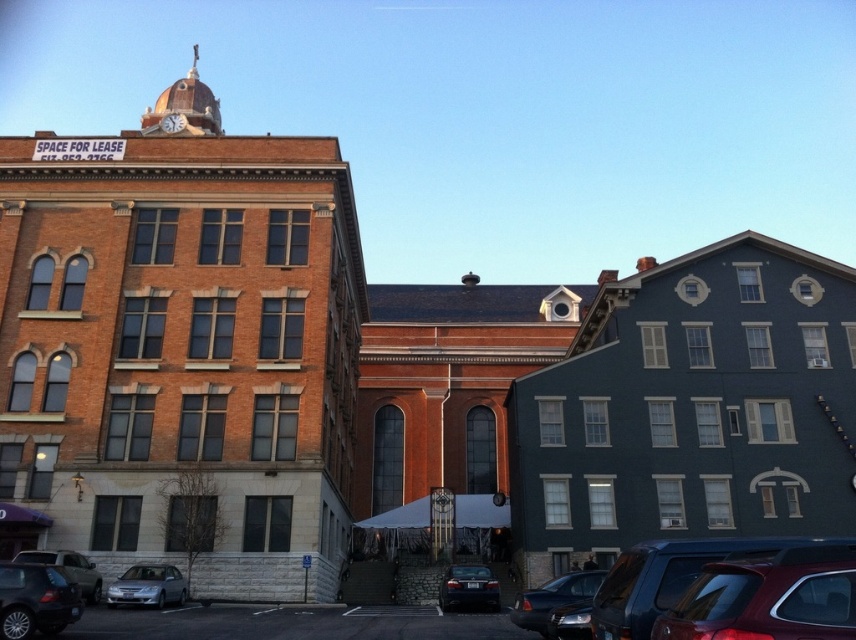
Question: Is shiny red car at lower right further to camera compared to matte silver suv at lower left?

Choices:
 (A) no
 (B) yes

Answer: (A)

Question: Considering the real-world distances, which object is farthest from the matte black car at lower left?

Choices:
 (A) metallic clock at upper center
 (B) shiny black sedan at lower right
 (C) satin silver sedan at lower left
 (D) matte silver suv at lower left

Answer: (A)

Question: Which point appears closest to the camera in this image?

Choices:
 (A) (7, 573)
 (B) (496, 596)
 (C) (849, 618)

Answer: (C)

Question: Can you confirm if shiny black sedan at center is bigger than matte silver suv at lower left?

Choices:
 (A) no
 (B) yes

Answer: (A)

Question: Is matte black car at lower left smaller than shiny black sedan at lower right?

Choices:
 (A) yes
 (B) no

Answer: (A)

Question: Which of the following is the farthest from the observer?

Choices:
 (A) shiny black sedan at center
 (B) shiny black sedan at lower right

Answer: (A)